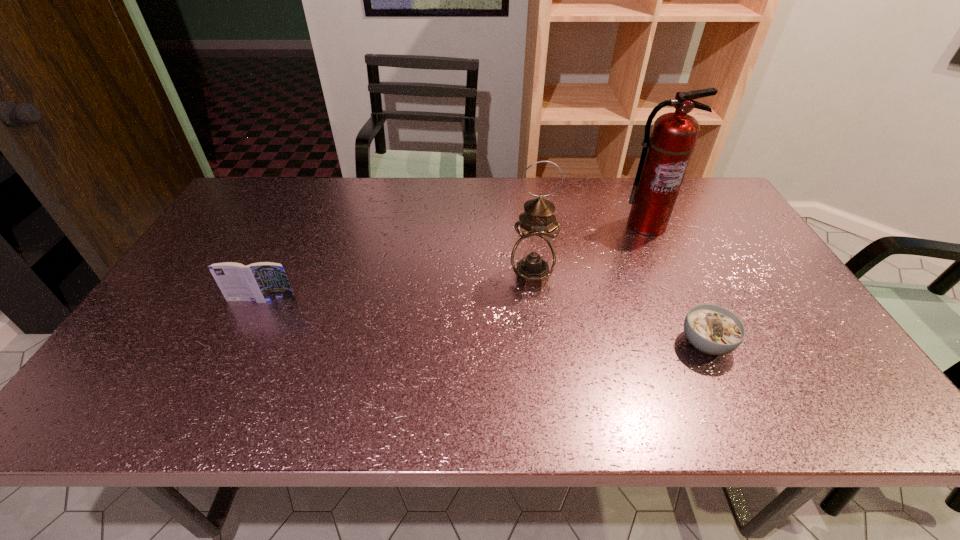
Identify the location of vacant point located between the soup bowl and the tallest object. (676, 284).

You are a GUI agent. You are given a task and a screenshot of the screen. Output one action in this format:
    pyautogui.click(x=<x>, y=<y>)
    Task: Click on the free spot between the second tallest object and the nearest object
    
    Given the screenshot: What is the action you would take?
    point(619,309)

Where is `free space between the leftmost object and the third shortest object`? This screenshot has height=540, width=960. free space between the leftmost object and the third shortest object is located at coordinates (397, 288).

The width and height of the screenshot is (960, 540). Find the location of `vacant point located between the book and the farthest object`. vacant point located between the book and the farthest object is located at coordinates point(454,262).

Identify the location of free space between the third nearest object and the book. click(x=397, y=288).

I want to click on free space between the book and the oil lamp, so click(x=397, y=288).

Locate an element on the screen. The height and width of the screenshot is (540, 960). unoccupied position between the soup bowl and the third nearest object is located at coordinates (619, 309).

This screenshot has width=960, height=540. I want to click on blank region between the second farthest object and the farthest object, so click(x=589, y=251).

Find the location of `the third closest object relative to the second object from left to right`. the third closest object relative to the second object from left to right is located at coordinates (261, 282).

The image size is (960, 540). Identify the location of the closest object to the farthest object. (533, 258).